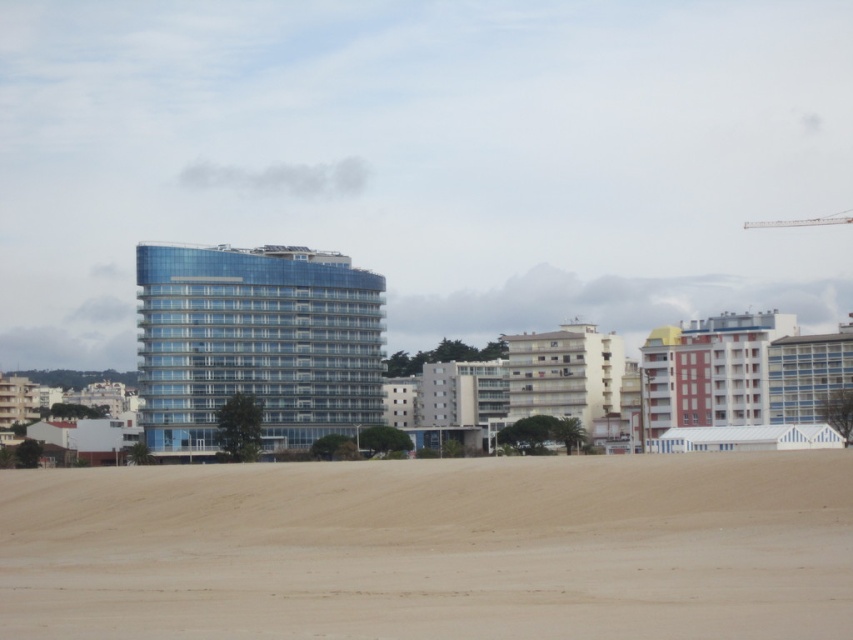
Based on the photo, who is lower down, beige sandy beach at lower center or white matte building at center?

white matte building at center is lower down.

Where is `beige sandy beach at lower center`? beige sandy beach at lower center is located at coordinates (434, 548).

Who is more distant from viewer, (196, 304) or (831, 216)?

Positioned behind is point (831, 216).

Is transparent glass building at center above metallic gray crane at upper right?

Actually, transparent glass building at center is below metallic gray crane at upper right.

Where is `transparent glass building at center`? This screenshot has height=640, width=853. transparent glass building at center is located at coordinates (256, 342).

Who is more distant from viewer, (x=624, y=371) or (x=825, y=218)?

Positioned behind is point (x=825, y=218).

Does point (601, 339) come behind point (746, 224)?

No.

In order to click on white matte building at center in this screenshot , I will do 567,376.

Find the location of a particular element. This screenshot has height=640, width=853. white matte building at center is located at coordinates pyautogui.click(x=567, y=376).